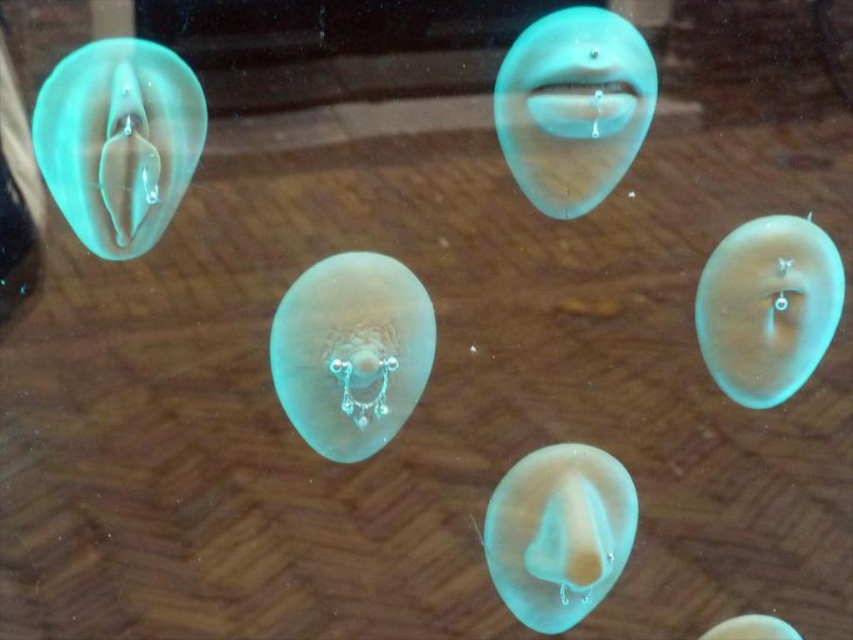
You are an interior designer arranging a display. You have to decide the order of the translucent rubber jellyfish at upper left and the translucent rubber lips at upper center. Which object is closer to the viewer?

The translucent rubber jellyfish at upper left is closer to the viewer than the translucent rubber lips at upper center because it is in front of it.

You are arranging a display and need to place a new object between the translucent rubber jellyfish at upper left and the translucent rubber lips at upper center. Which object should you place to the left of the other?

The translucent rubber jellyfish at upper left is already positioned on the left side of the translucent rubber lips at upper center, so you should place the new object to the left of the translucent rubber jellyfish at upper left to maintain the left to right order.

You are organizing a display and need to place the translucent rubber nose at bottom center and the translucent rubber jellyfish at right on a shelf. The shelf has a height limit of 10 cm. Which object might not fit if the jellyfish is taller than the nose?

The translucent rubber jellyfish at right might not fit on the shelf because it is taller than the translucent rubber nose at bottom center, and if its height exceeds 10 cm, it would surpass the shelf limit.